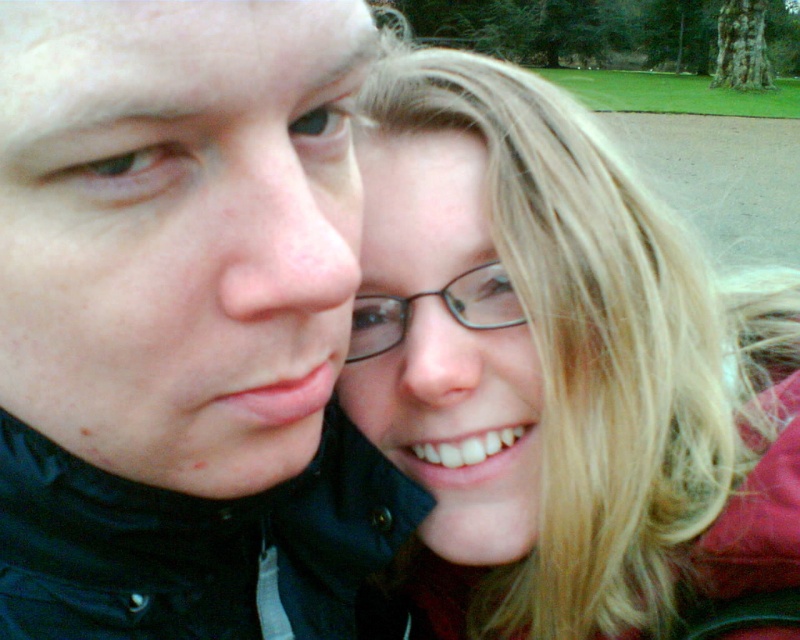
You are taking a photo of two people and want to ensure their accessories are visible. Given that the smooth blonde hair at center and the black plastic glasses at center are both in focus, which one is wider in the image?

The smooth blonde hair at center is wider than the black plastic glasses at center.

You are taking a photo of two people in a park. You notice the matte black jacket at left and the black plastic glasses at center. Which object is located more to the left side?

The matte black jacket at left is positioned on the left side of black plastic glasses at center, so it is more to the left.